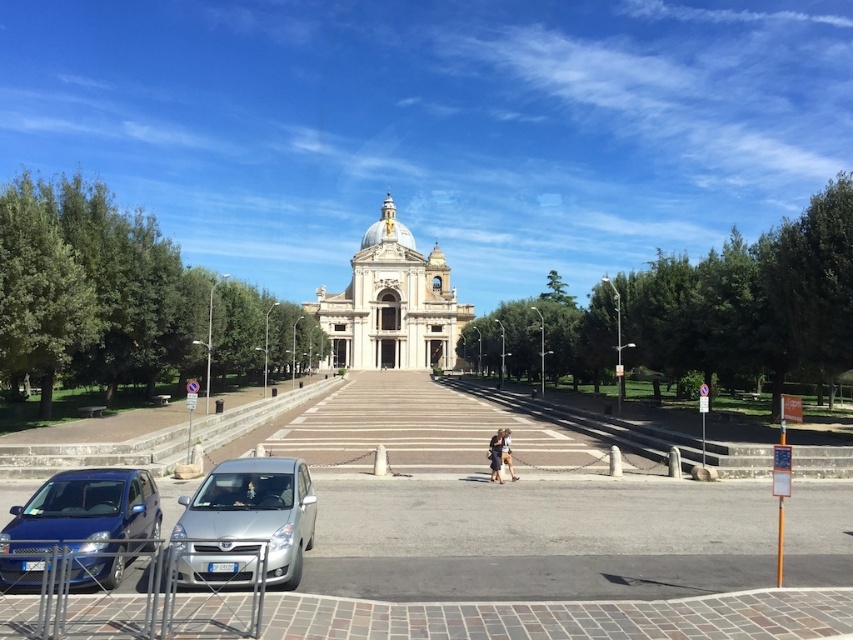
You are standing at the entrance of the grand classical building and see a metallic blue hatchback at lower left and a dark brown leather jacket at center. Which object is closer to you?

The metallic blue hatchback at lower left is closer to you than the dark brown leather jacket at center because they are 55.64 meters apart.

You are standing in the plaza in front of the white marble church at center and the dark brown leather jacket at center. Which object is positioned to the left from your perspective?

The white marble church at center is to the left of the dark brown leather jacket at center, so the white marble church at center is positioned to the left.